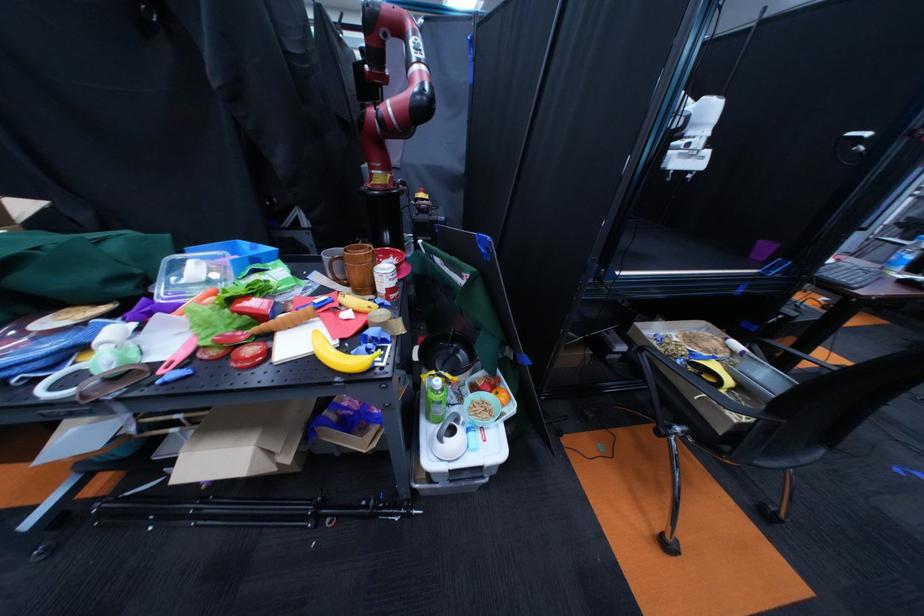
Where would you sit the chair sitting surface? Please return your answer as a coordinate pair (x, y).

(891, 432)